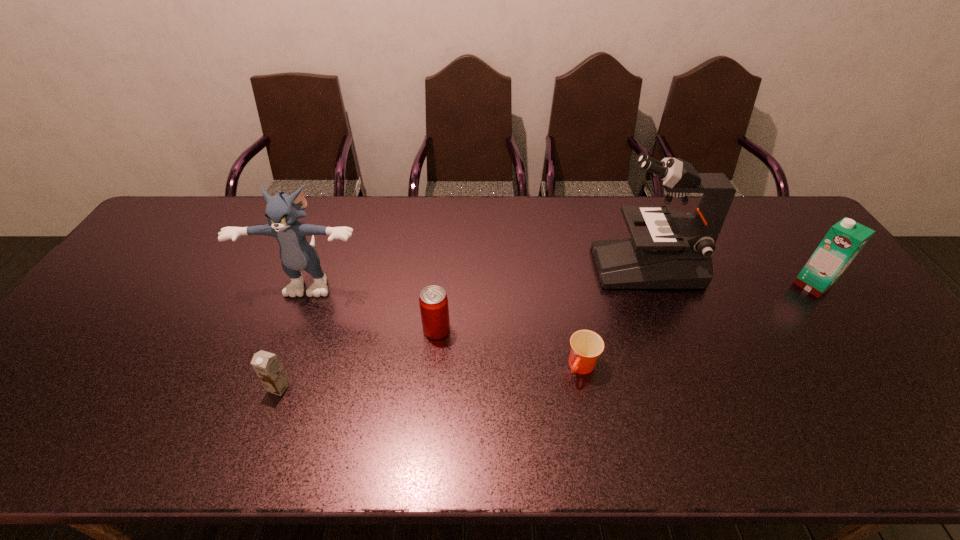
At what (x,y) coordinates should I click in order to perform the action: click on vacant area at the left edge. Please return your answer as a coordinate pair (x, y). The width and height of the screenshot is (960, 540). Looking at the image, I should click on (132, 322).

Locate an element on the screen. The height and width of the screenshot is (540, 960). vacant space at the right edge of the desktop is located at coordinates (903, 350).

At what (x,y) coordinates should I click in order to perform the action: click on vacant area that lies between the chocolate milk and the carton. Please return your answer as a coordinate pair (x, y). Looking at the image, I should click on (545, 336).

This screenshot has height=540, width=960. What are the coordinates of `free space between the shortest object and the chocolate milk` in the screenshot? It's located at (430, 377).

This screenshot has width=960, height=540. What are the coordinates of `free space between the chocolate milk and the fourth farthest object` in the screenshot? It's located at (358, 358).

Where is `vacant space that is in between the third object from right to left and the can`? The width and height of the screenshot is (960, 540). vacant space that is in between the third object from right to left and the can is located at coordinates (509, 348).

Locate an element on the screen. free spot between the fifth shortest object and the third tallest object is located at coordinates (563, 281).

Identify the location of unoccupied area between the can and the second tallest object. This screenshot has width=960, height=540. (374, 303).

You are a GUI agent. You are given a task and a screenshot of the screen. Output one action in this format:
    pyautogui.click(x=<x>, y=<y>)
    Task: Click on the free space that is in between the third object from right to left and the chocolate milk
    
    Given the screenshot: What is the action you would take?
    pyautogui.click(x=430, y=377)

Image resolution: width=960 pixels, height=540 pixels. I want to click on blank region between the microscope and the fourth farthest object, so click(x=541, y=298).